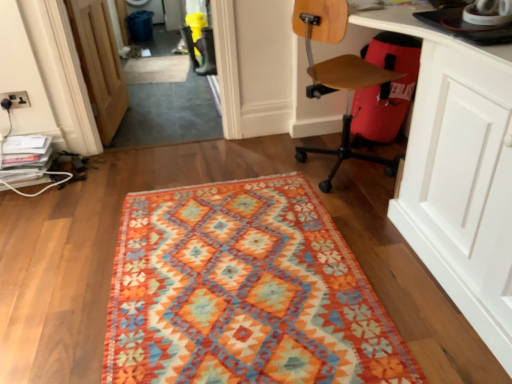
Image resolution: width=512 pixels, height=384 pixels. I want to click on free space to the right of wooden door at left, so click(x=172, y=118).